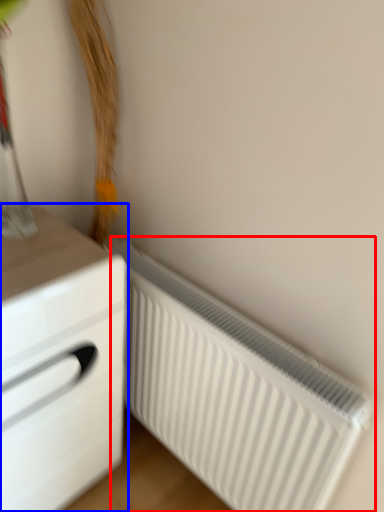
Question: Which object appears closest to the camera in this image, radiator (highlighted by a red box) or chest of drawers (highlighted by a blue box)?

Choices:
 (A) radiator
 (B) chest of drawers

Answer: (B)